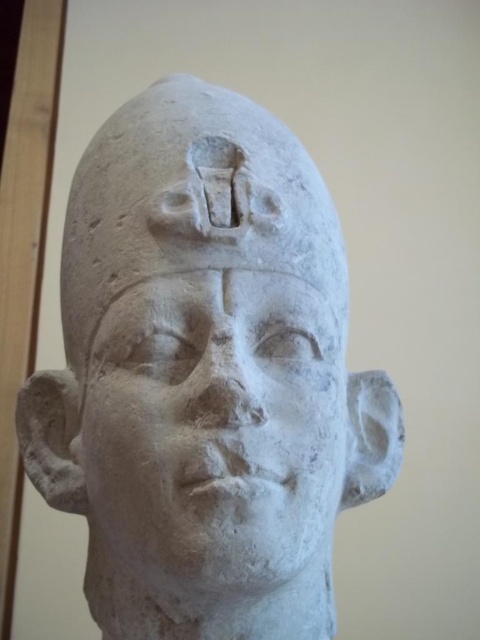
You are an archaeologist examining the stone sculpture. You notice two distinct parts of the sculpture labeled as the white stone head at center and the white stone face at center. Based on their positions, which part is positioned higher?

The white stone head at center is positioned higher than the white stone face at center.

You are an archaeologist examining the stone sculpture. You notice two parts of the sculpture labeled as the white stone head at center and the white stone face at center. Which part is taller?

The white stone head at center is taller than the white stone face at center according to the description.